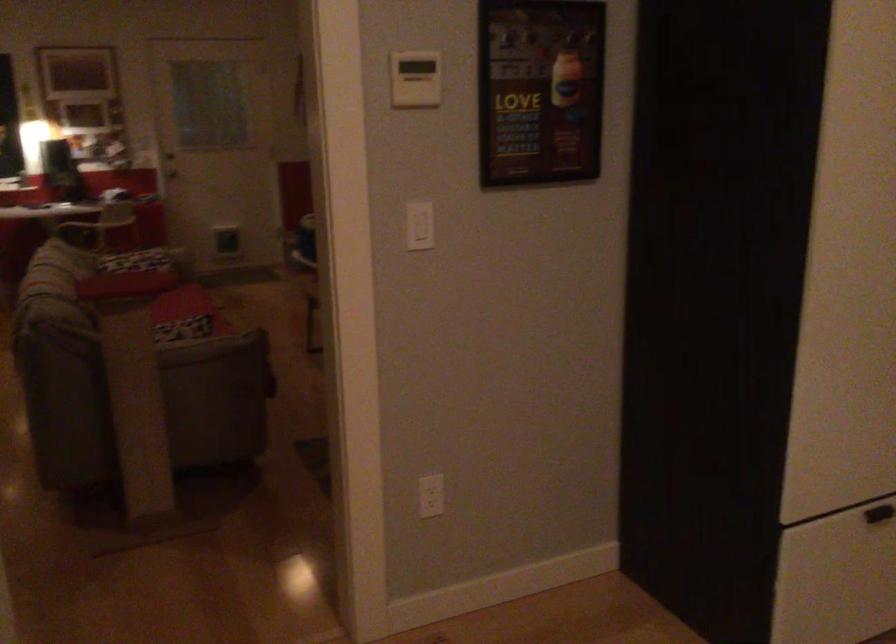
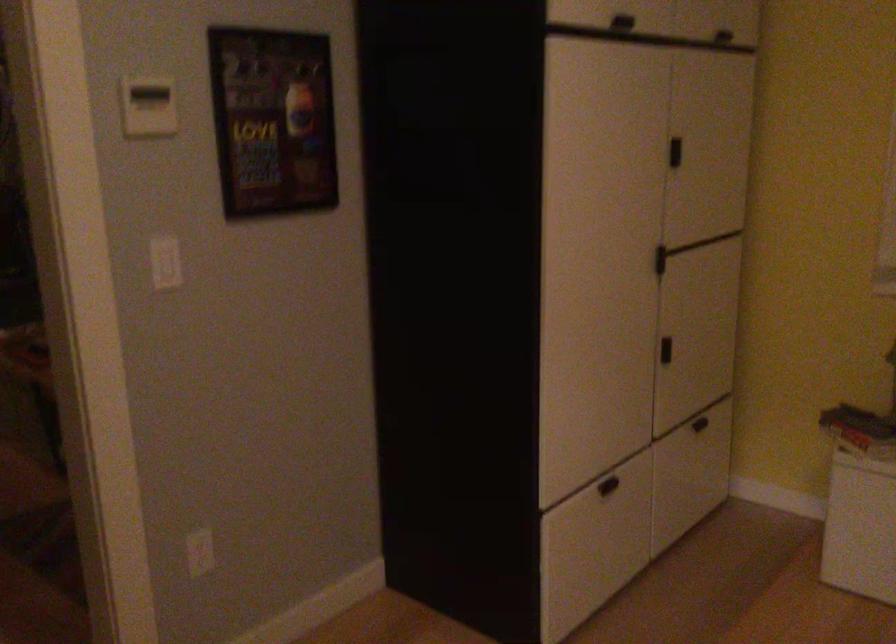
Question: The first image is from the beginning of the video and the second image is from the end. How did the camera likely rotate when shooting the video?

Choices:
 (A) Left
 (B) Right
 (C) Up
 (D) Down

Answer: (B)